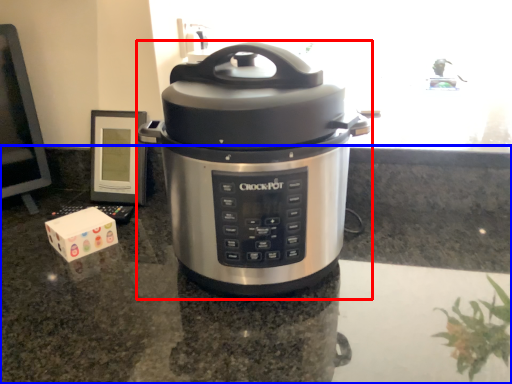
Question: Which point is further to the camera, slow cooker (highlighted by a red box) or counter top (highlighted by a blue box)?

Choices:
 (A) slow cooker
 (B) counter top

Answer: (A)